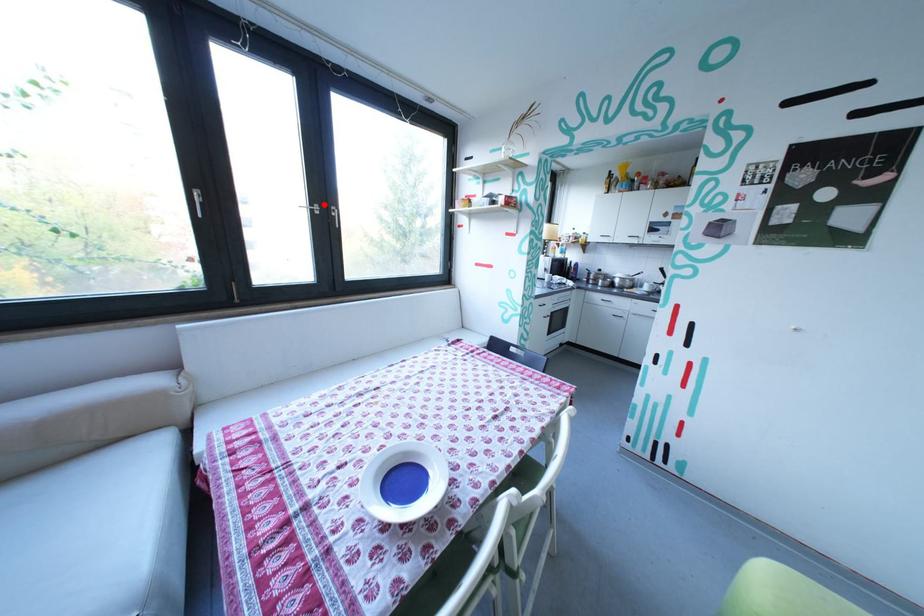
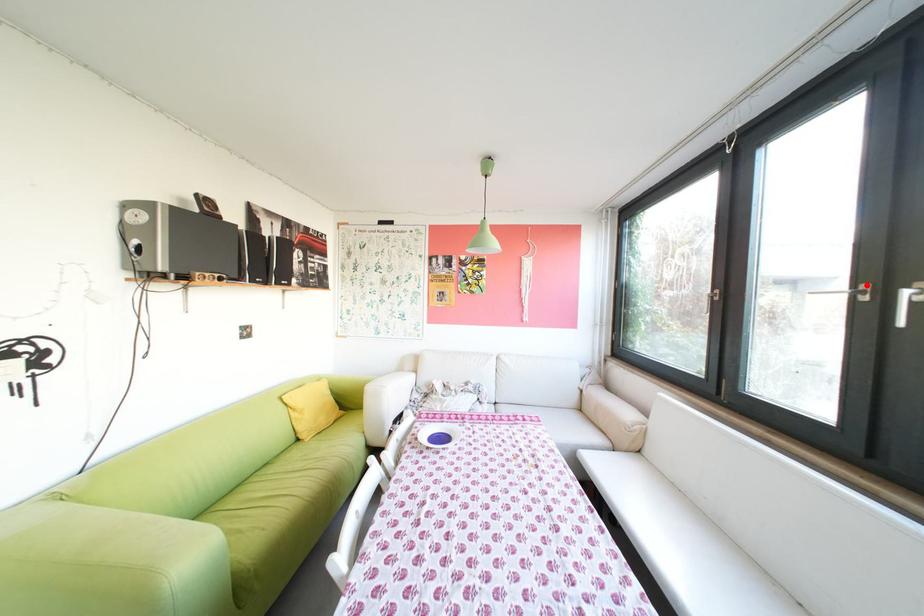
I am providing you with two images of the same scene from different viewpoints. A red point is marked on the first image and another point is marked on the second image. Does the point marked in image1 correspond to the same location as the one in image2?

Yes